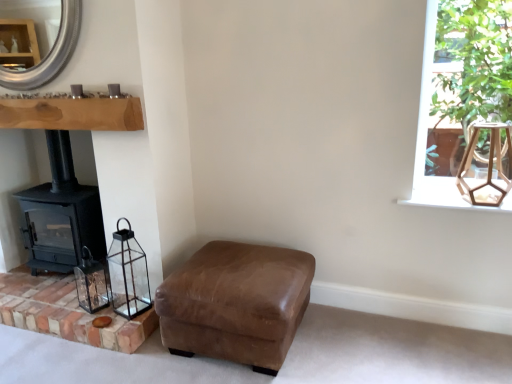
Where is `free space between clear glass lantern at lower left and clear glass lantern at lower left, acting as the first lamp starting from the left`? The height and width of the screenshot is (384, 512). free space between clear glass lantern at lower left and clear glass lantern at lower left, acting as the first lamp starting from the left is located at coordinates (112, 304).